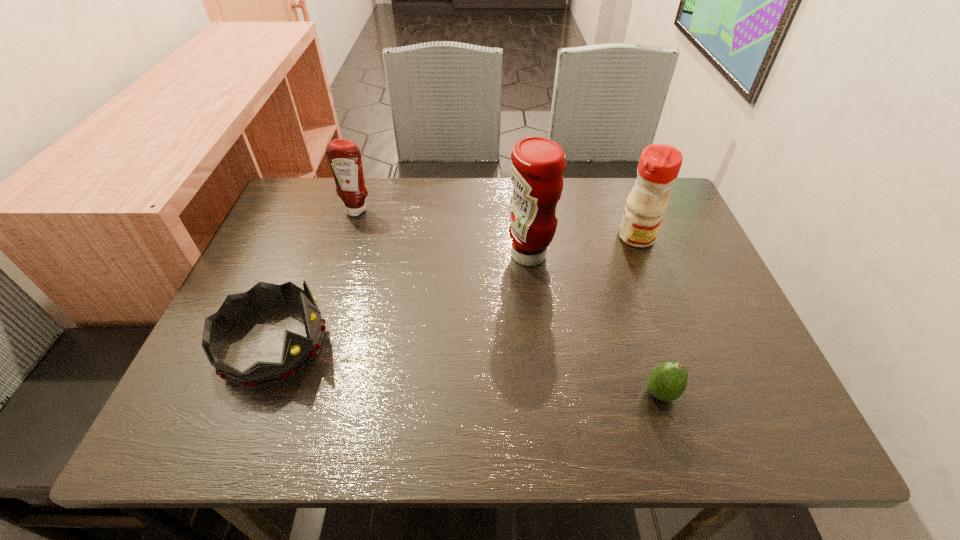
Identify the location of the second condiment from left to right. (538, 163).

Locate an element on the screen. The height and width of the screenshot is (540, 960). the rightmost condiment is located at coordinates click(659, 165).

Where is `the second tallest object`? The height and width of the screenshot is (540, 960). the second tallest object is located at coordinates (659, 165).

Locate an element on the screen. This screenshot has height=540, width=960. the shortest condiment is located at coordinates (344, 156).

The width and height of the screenshot is (960, 540). Find the location of `the farthest condiment`. the farthest condiment is located at coordinates (344, 156).

Locate an element on the screen. The width and height of the screenshot is (960, 540). the second shortest object is located at coordinates (298, 351).

Locate an element on the screen. avocado is located at coordinates (667, 381).

Identify the location of vacant space situated 0.220m on the left of the second condiment from right to left. (419, 255).

Find the location of a particular element. free region located 0.400m on the left of the second tallest condiment is located at coordinates (466, 237).

What are the coordinates of `free point located 0.190m on the front of the leftmost condiment` in the screenshot? It's located at (340, 266).